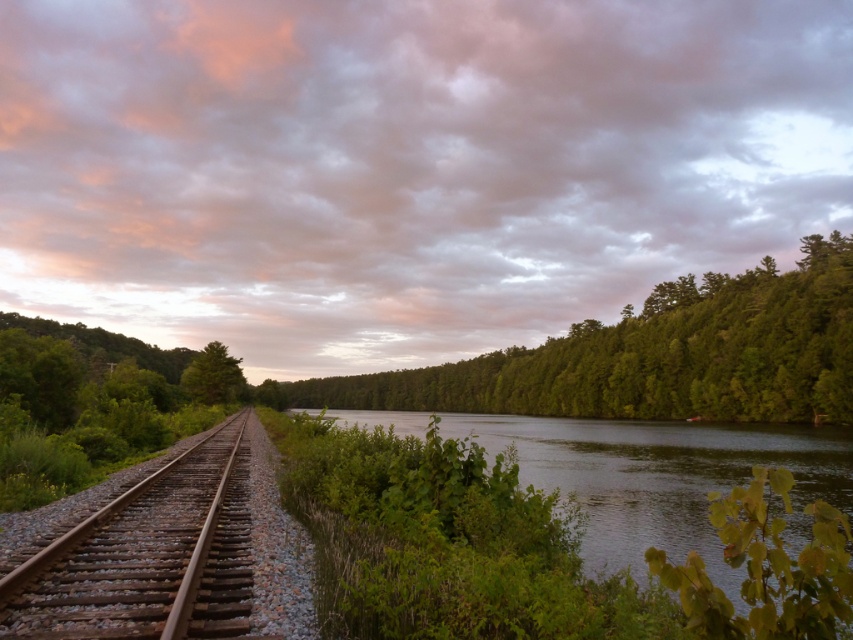
Who is shorter, green leafy trees at center or green matte tree at center?

green matte tree at center is shorter.

Who is taller, green leafy trees at center or green matte tree at center?

Standing taller between the two is green leafy trees at center.

Where is `green leafy trees at center`? green leafy trees at center is located at coordinates (656, 356).

Between green leafy river at center and green matte tree at center, which one has more height?

green matte tree at center is taller.

The height and width of the screenshot is (640, 853). Describe the element at coordinates (541, 548) in the screenshot. I see `green leafy river at center` at that location.

I want to click on green leafy river at center, so 541,548.

Is green leafy river at center shorter than green leafy trees at center?

Yes, green leafy river at center is shorter than green leafy trees at center.

Measure the distance between point (764, 563) and camera.

Point (764, 563) and camera are 11.24 feet apart from each other.

Does point (778, 548) come closer to viewer compared to point (283, 385)?

Yes.

The image size is (853, 640). I want to click on green leafy river at center, so click(541, 548).